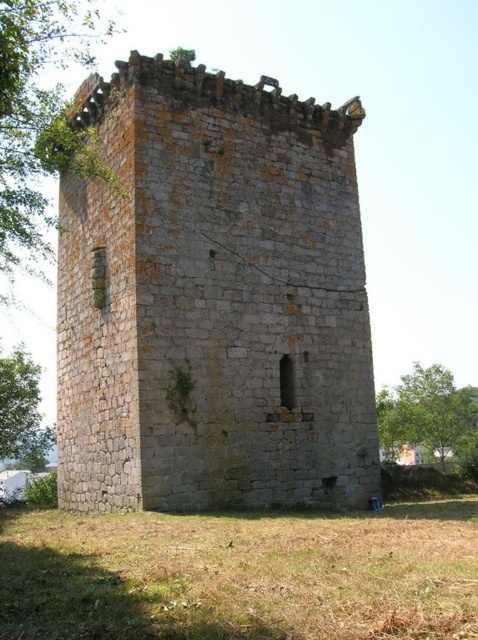
Can you confirm if green leafy tree at upper left is smaller than green leafy tree at lower left?

Incorrect, green leafy tree at upper left is not smaller in size than green leafy tree at lower left.

Based on the photo, does green leafy tree at upper left have a lesser height compared to green leafy tree at lower left?

Incorrect, green leafy tree at upper left's height does not fall short of green leafy tree at lower left's.

What do you see at coordinates (40, 118) in the screenshot? I see `green leafy tree at upper left` at bounding box center [40, 118].

Identify the location of green leafy tree at upper left. (40, 118).

Who is positioned more to the right, green leafy tree at lower right or green leafy tree at lower left?

Positioned to the right is green leafy tree at lower right.

Can you confirm if green leafy tree at lower right is positioned to the left of green leafy tree at lower left?

In fact, green leafy tree at lower right is to the right of green leafy tree at lower left.

Is point (392, 433) in front of point (40, 397)?

Yes, it is in front of point (40, 397).

This screenshot has height=640, width=478. What are the coordinates of `green leafy tree at lower right` in the screenshot? It's located at (430, 419).

Measure the distance between point (123, 468) and camera.

Point (123, 468) and camera are 123.49 feet apart from each other.

Is point (217, 413) more distant than point (402, 416)?

No, it is not.

Is point (333, 209) positioned after point (459, 456)?

No, (333, 209) is in front of (459, 456).

Where is `gray stone tower at center`? gray stone tower at center is located at coordinates (213, 300).